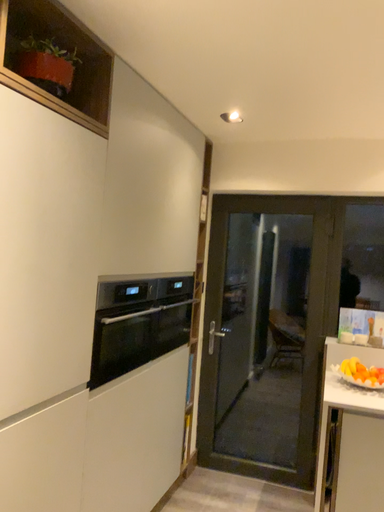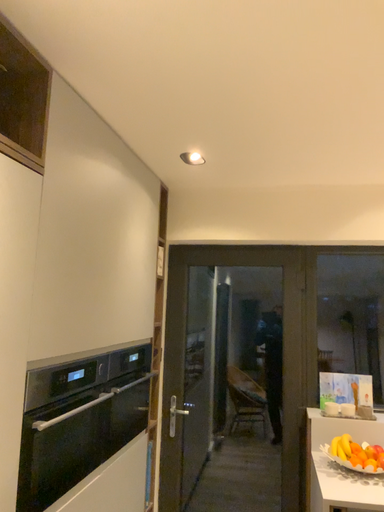
Question: How did the camera likely rotate when shooting the video?

Choices:
 (A) rotated left
 (B) rotated right

Answer: (B)